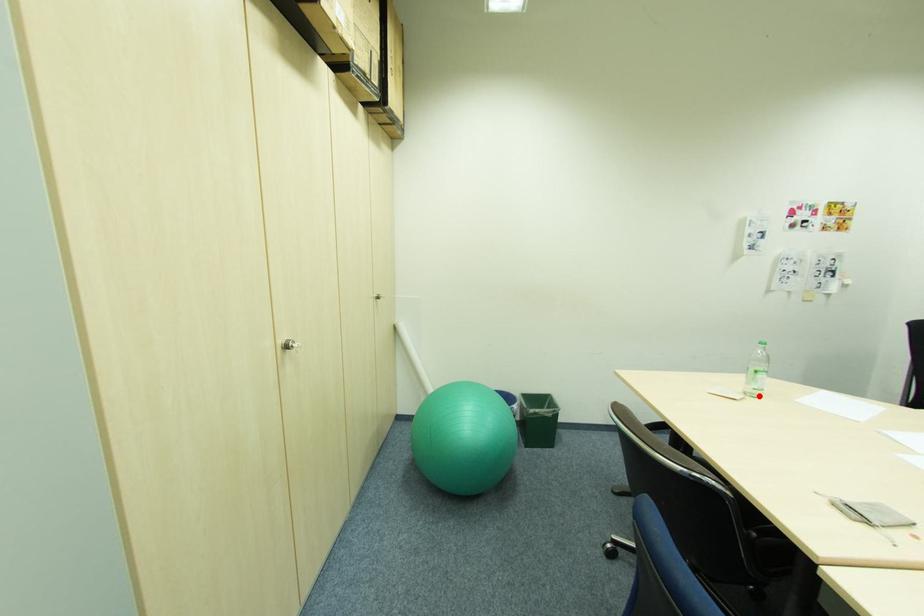
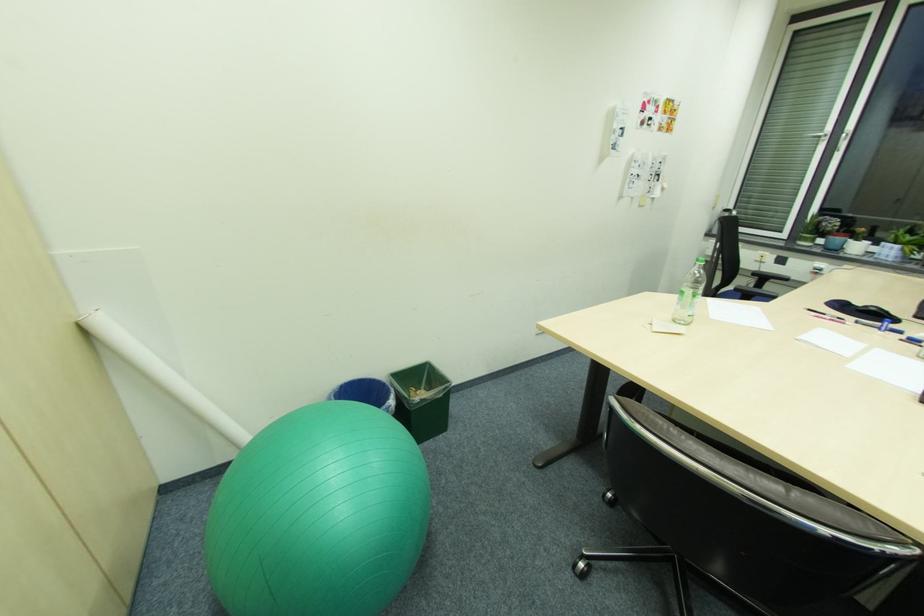
Locate, in the second image, the point that corresponds to the highlighted location in the first image.

(688, 323)